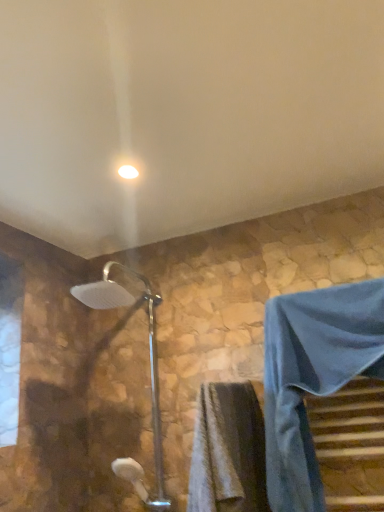
Describe the element at coordinates (228, 451) in the screenshot. I see `gray textured towel at lower center` at that location.

The image size is (384, 512). Identify the location of silver metallic shower head at center. (150, 370).

Describe the element at coordinates (313, 377) in the screenshot. The height and width of the screenshot is (512, 384). I see `blue fabric robe at lower right` at that location.

This screenshot has width=384, height=512. I want to click on gray textured towel at lower center, so click(228, 451).

Would you say blue fabric robe at lower right is inside or outside gray textured towel at lower center?

blue fabric robe at lower right lies outside gray textured towel at lower center.

Can you tell me how much blue fabric robe at lower right and gray textured towel at lower center differ in facing direction?

The angle between the facing direction of blue fabric robe at lower right and the facing direction of gray textured towel at lower center is 90.7 degrees.

Is blue fabric robe at lower right far away from gray textured towel at lower center?

That's not correct — blue fabric robe at lower right is a little close to gray textured towel at lower center.

From a real-world perspective, is blue fabric robe at lower right above or below gray textured towel at lower center?

From a real-world perspective, blue fabric robe at lower right is physically above gray textured towel at lower center.

From the image's perspective, is silver metallic shower head at center positioned above or below blue fabric robe at lower right?

Based on their image positions, silver metallic shower head at center is located beneath blue fabric robe at lower right.

Is point (153, 330) positioned before point (317, 375)?

No, it is not.

Does silver metallic shower head at center have a larger size compared to blue fabric robe at lower right?

Correct, silver metallic shower head at center is larger in size than blue fabric robe at lower right.

Considering the sizes of blue fabric robe at lower right and silver metallic shower head at center in the image, is blue fabric robe at lower right wider or thinner than silver metallic shower head at center?

Considering their sizes, blue fabric robe at lower right looks slimmer than silver metallic shower head at center.

Does blue fabric robe at lower right contain silver metallic shower head at center?

Definitely not — silver metallic shower head at center is not inside blue fabric robe at lower right.

Image resolution: width=384 pixels, height=512 pixels. What are the coordinates of `robe in front of the silver metallic shower head at center` in the screenshot? It's located at (313, 377).

Which of these two, white glossy light fixture at upper center or silver metallic shower head at center, is smaller?

With smaller size is white glossy light fixture at upper center.

Is point (133, 177) positioned before point (135, 483)?

Yes, point (133, 177) is closer to viewer.

Between white glossy light fixture at upper center and silver metallic shower head at center, which one has smaller width?

white glossy light fixture at upper center.

How much distance is there between white glossy light fixture at upper center and silver metallic shower head at center?

white glossy light fixture at upper center is 27.59 inches away from silver metallic shower head at center.

You are a GUI agent. You are given a task and a screenshot of the screen. Output one action in this format:
    pyautogui.click(x=<x>, y=<y>)
    Task: Click on the robe in front of the white glossy light fixture at upper center
    
    Given the screenshot: What is the action you would take?
    pyautogui.click(x=313, y=377)

In the scene shown: Is the position of white glossy light fixture at upper center less distant than that of blue fabric robe at lower right?

No, the depth of white glossy light fixture at upper center is greater than that of blue fabric robe at lower right.

Is white glossy light fixture at upper center next to blue fabric robe at lower right and touching it?

There is a gap between white glossy light fixture at upper center and blue fabric robe at lower right.

Based on the photo, from a real-world perspective, which object stands above the other?

white glossy light fixture at upper center.

From the image's perspective, is silver metallic shower head at center above or below gray textured towel at lower center?

silver metallic shower head at center is above gray textured towel at lower center.

How many degrees apart are the facing directions of silver metallic shower head at center and gray textured towel at lower center?

The angle between the facing direction of silver metallic shower head at center and the facing direction of gray textured towel at lower center is 91.6 degrees.

Is the position of silver metallic shower head at center less distant than that of gray textured towel at lower center?

No, silver metallic shower head at center is further to the viewer.

In the image, there is a silver metallic shower head at center. Where is `bath towel below it (from a real-world perspective)`? The width and height of the screenshot is (384, 512). bath towel below it (from a real-world perspective) is located at coordinates (228, 451).

Is blue fabric robe at lower right spatially inside white glossy light fixture at upper center, or outside of it?

blue fabric robe at lower right is located beyond the bounds of white glossy light fixture at upper center.

Does blue fabric robe at lower right touch white glossy light fixture at upper center?

No.

Which of these two, blue fabric robe at lower right or white glossy light fixture at upper center, is wider?

Wider between the two is blue fabric robe at lower right.

Which is more distant, (299, 298) or (127, 178)?

The point (127, 178) is behind.

Image resolution: width=384 pixels, height=512 pixels. What are the coordinates of `bath towel lying below the blue fabric robe at lower right (from the image's perspective)` in the screenshot? It's located at (228, 451).

Where is `robe above the silver metallic shower head at center (from the image's perspective)`? The image size is (384, 512). robe above the silver metallic shower head at center (from the image's perspective) is located at coordinates (313, 377).

Considering their positions, is gray textured towel at lower center positioned closer to blue fabric robe at lower right than white glossy light fixture at upper center?

Among the two, gray textured towel at lower center is located nearer to blue fabric robe at lower right.

Based on their spatial positions, is blue fabric robe at lower right or white glossy light fixture at upper center closer to gray textured towel at lower center?

Among the two, blue fabric robe at lower right is located nearer to gray textured towel at lower center.

From the image, which object appears to be farther from silver metallic shower head at center, gray textured towel at lower center or blue fabric robe at lower right?

The object further to silver metallic shower head at center is blue fabric robe at lower right.

Estimate the real-world distances between objects in this image. Which object is further from blue fabric robe at lower right, silver metallic shower head at center or white glossy light fixture at upper center?

The object further to blue fabric robe at lower right is white glossy light fixture at upper center.

From the image, which object appears to be farther from silver metallic shower head at center, white glossy light fixture at upper center or blue fabric robe at lower right?

white glossy light fixture at upper center lies further to silver metallic shower head at center than the other object.

When comparing their distances from silver metallic shower head at center, does gray textured towel at lower center or white glossy light fixture at upper center seem closer?

Based on the image, gray textured towel at lower center appears to be nearer to silver metallic shower head at center.

Based on their spatial positions, is blue fabric robe at lower right or silver metallic shower head at center further from gray textured towel at lower center?

The object further to gray textured towel at lower center is silver metallic shower head at center.

Consider the image. Considering their positions, is blue fabric robe at lower right positioned further to silver metallic shower head at center than white glossy light fixture at upper center?

white glossy light fixture at upper center is further to silver metallic shower head at center.

Where is `bath towel between silver metallic shower head at center and blue fabric robe at lower right from left to right`? This screenshot has height=512, width=384. bath towel between silver metallic shower head at center and blue fabric robe at lower right from left to right is located at coordinates (228, 451).

I want to click on robe between white glossy light fixture at upper center and gray textured towel at lower center in the vertical direction, so click(313, 377).

At what (x,y) coordinates should I click in order to perform the action: click on robe between white glossy light fixture at upper center and silver metallic shower head at center in the up-down direction. Please return your answer as a coordinate pair (x, y). Looking at the image, I should click on click(313, 377).

Locate an element on the screen. shower between white glossy light fixture at upper center and gray textured towel at lower center vertically is located at coordinates (150, 370).